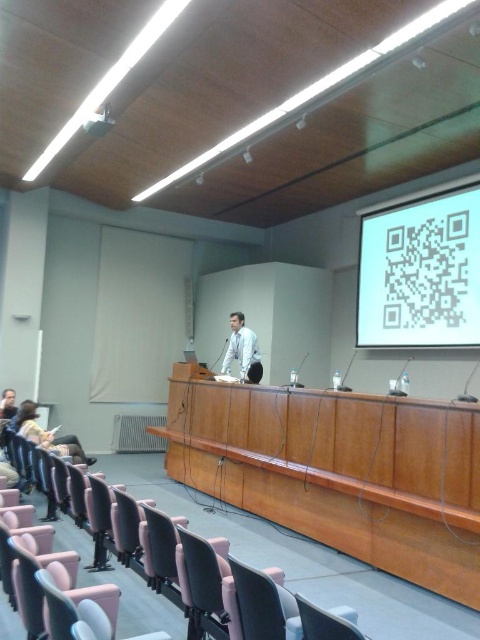
You are organizing a small workshop and need to arrange seating for 10 participants. The room has a matte pink plastic chair at lower center and a white glossy projector at upper center. Considering their sizes, which object would require more floor space when placing additional chairs?

The matte pink plastic chair at lower center requires more floor space than the white glossy projector at upper center because its width is larger, as stated in the description.

You are an attendee at the lecture hall and want to scan the white matte qr code at upper right. However, the white glossy shirt at center is obstructing your view. Can you determine which object is closer to you based on their positions?

The white matte qr code at upper right is in front of the white glossy shirt at center, so it is closer to you.